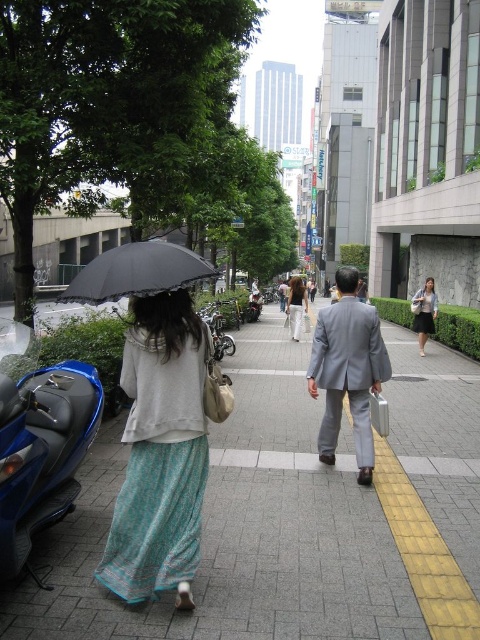
Question: Is gray suit at center behind light gray suit at center?

Choices:
 (A) no
 (B) yes

Answer: (A)

Question: Which object is farther from the camera taking this photo?

Choices:
 (A) light blue textured skirt at left
 (B) blue glossy scooter at left
 (C) gray concrete sidewalk at center

Answer: (A)

Question: Among these points, which one is farthest from the camera?

Choices:
 (A) (292, 324)
 (B) (87, 404)
 (C) (384, 369)
 (D) (111, 260)

Answer: (A)

Question: Which of these objects is positioned closest to the light gray suit at center?

Choices:
 (A) light blue fabric dress at center
 (B) blue glossy scooter at left
 (C) gray concrete sidewalk at center

Answer: (A)

Question: Is shiny chrome motorcycle at center closer to camera compared to blue metallic motorcycle at center?

Choices:
 (A) yes
 (B) no

Answer: (A)

Question: Does light blue fabric dress at center lie in front of light gray suit at center?

Choices:
 (A) no
 (B) yes

Answer: (B)